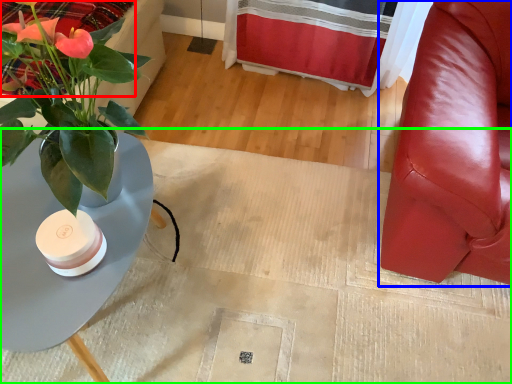
Question: Estimate the real-world distances between objects in this image. Which object is farther from bedding (highlighted by a red box), chair (highlighted by a blue box) or plain (highlighted by a green box)?

Choices:
 (A) chair
 (B) plain

Answer: (A)